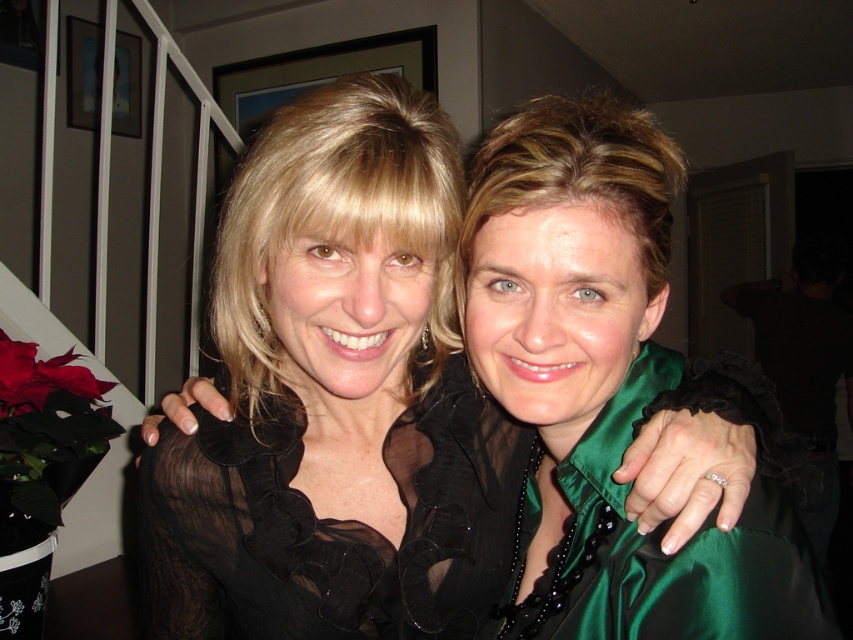
Does black sheer blouse at center have a smaller size compared to green satin dress at center?

No, black sheer blouse at center is not smaller than green satin dress at center.

Measure the distance from black sheer blouse at center to green satin dress at center.

black sheer blouse at center is 4.72 inches from green satin dress at center.

Is point (228, 333) positioned in front of point (619, 586)?

No.

Locate an element on the screen. The width and height of the screenshot is (853, 640). black sheer blouse at center is located at coordinates (329, 410).

Which is in front, point (347, 221) or point (340, 560)?

Positioned in front is point (347, 221).

Is black sheer blouse at center thinner than black sheer dress at center?

Incorrect, black sheer blouse at center's width is not less than black sheer dress at center's.

Is point (218, 285) farther from camera compared to point (427, 456)?

Yes, point (218, 285) is behind point (427, 456).

This screenshot has height=640, width=853. I want to click on black sheer blouse at center, so click(329, 410).

Measure the distance between point (242, 429) and camera.

Point (242, 429) is 25.08 inches from camera.

Can you confirm if black sheer dress at center is thinner than green satin dress at center?

No, black sheer dress at center is not thinner than green satin dress at center.

Is point (453, 536) less distant than point (531, 472)?

Yes, point (453, 536) is closer to viewer.

The height and width of the screenshot is (640, 853). Identify the location of black sheer dress at center. (329, 525).